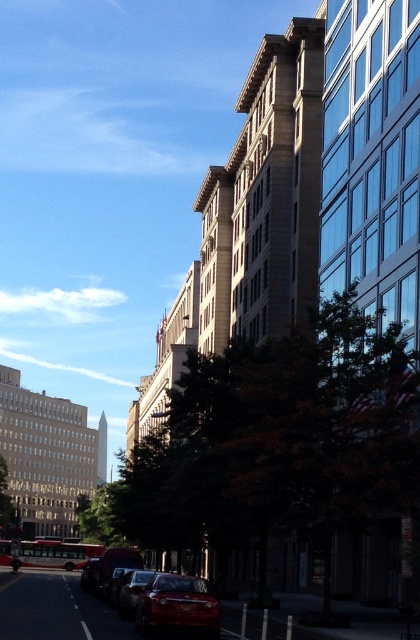
Question: Which of the following is the farthest from the observer?

Choices:
 (A) (139, 600)
 (B) (125, 589)
 (C) (86, 564)
 (D) (120, 547)

Answer: (C)

Question: Is shiny metallic car at lower center to the left of shiny red car at lower left from the viewer's perspective?

Choices:
 (A) no
 (B) yes

Answer: (A)

Question: Which point is closer to the camera taking this photo?

Choices:
 (A) (89, 588)
 (B) (130, 576)

Answer: (B)

Question: Which point is closer to the camera taking this photo?

Choices:
 (A) (141, 577)
 (B) (160, 611)
 (C) (91, 576)

Answer: (B)

Question: Observing the image, what is the correct spatial positioning of shiny red sedan at lower center in reference to glossy red car at lower center?

Choices:
 (A) right
 (B) left

Answer: (B)

Question: From the image, what is the correct spatial relationship of glossy red car at lower center in relation to shiny red car at lower left?

Choices:
 (A) right
 (B) left

Answer: (A)